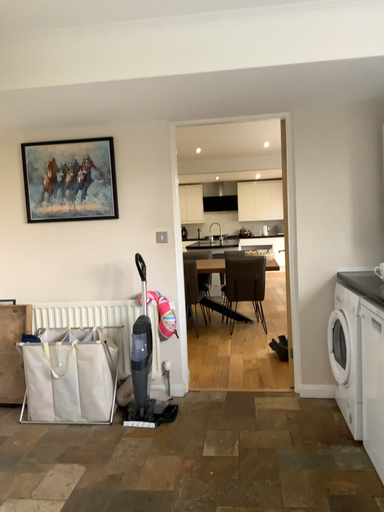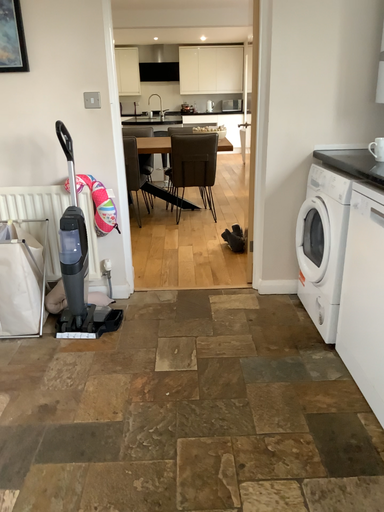
Question: Which way did the camera rotate in the video?

Choices:
 (A) rotated upward
 (B) rotated downward

Answer: (B)